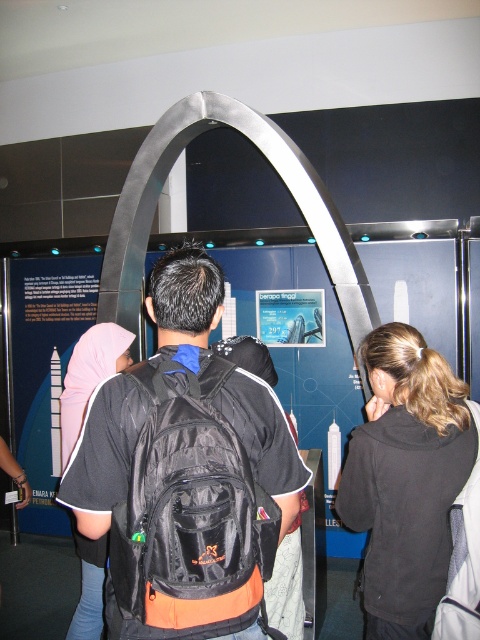
Question: Can you confirm if black fabric jacket at center is wider than matte pink hijab at upper left?

Choices:
 (A) no
 (B) yes

Answer: (B)

Question: Which object is farther from the camera taking this photo?

Choices:
 (A) black fabric backpack at center
 (B) black fabric jacket at center

Answer: (B)

Question: Which is farther from the black fabric backpack at center?

Choices:
 (A) matte pink hijab at upper left
 (B) black fabric jacket at center

Answer: (A)

Question: Among these points, which one is nearest to the camera?

Choices:
 (A) (121, 344)
 (B) (200, 259)
 (C) (387, 378)

Answer: (B)

Question: Observing the image, what is the correct spatial positioning of black fabric backpack at center in reference to matte pink hijab at upper left?

Choices:
 (A) below
 (B) above

Answer: (A)

Question: Does black fabric jacket at center have a lesser width compared to matte pink hijab at upper left?

Choices:
 (A) no
 (B) yes

Answer: (A)